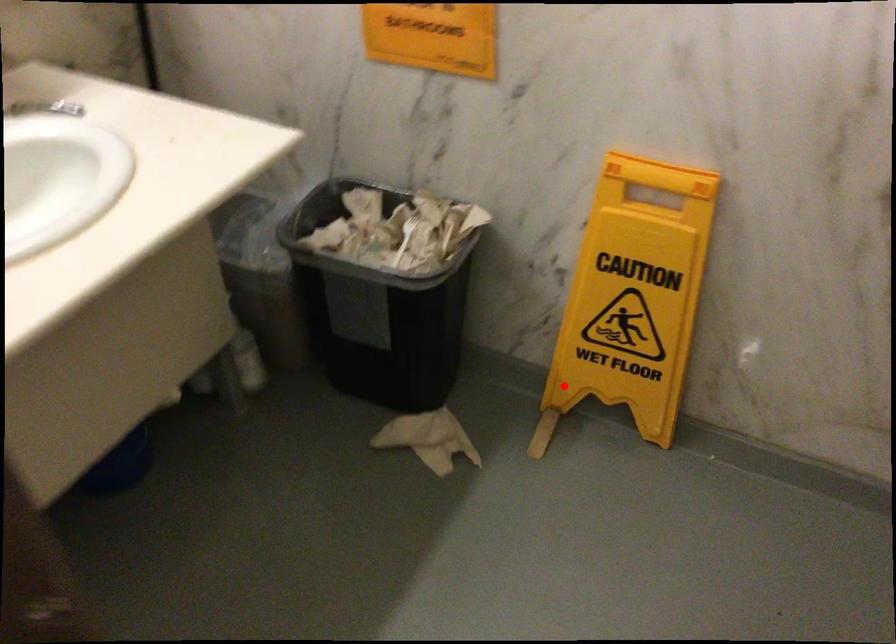
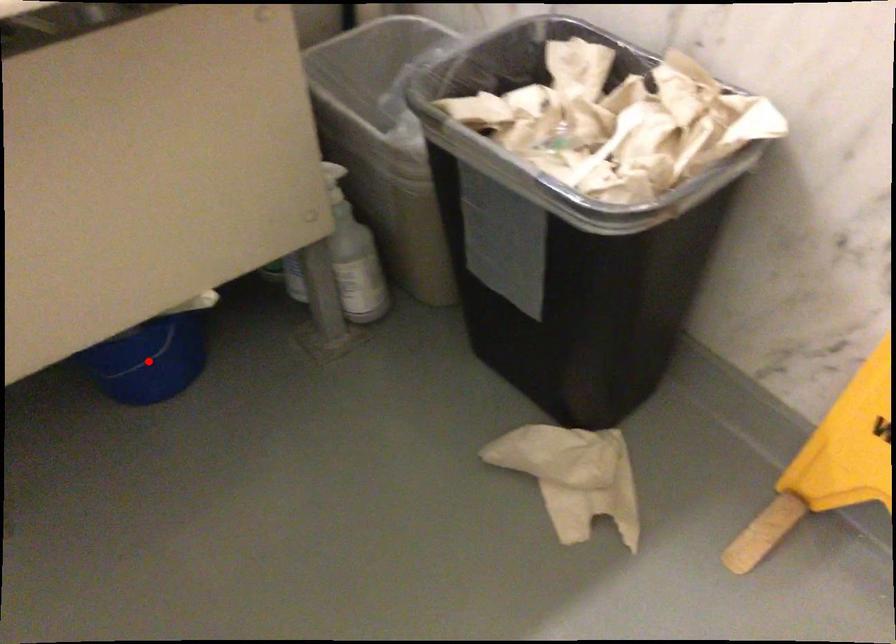
I am providing you with two images of the same scene from different viewpoints. A red point is marked on the first image and another point is marked on the second image. Are the points marked in image1 and image2 representing the same 3D position?

No